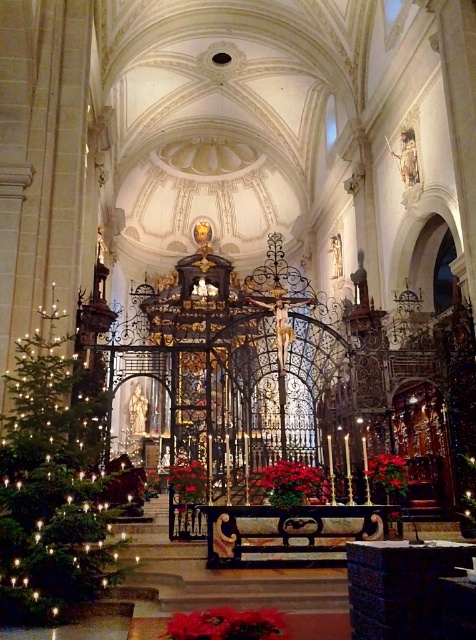
Is green matte christmas tree at left below red velvet poinsettia at lower center?

No.

Can you confirm if green matte christmas tree at left is shorter than red velvet poinsettia at lower center?

No.

This screenshot has height=640, width=476. Find the location of `green matte christmas tree at left`. green matte christmas tree at left is located at coordinates (51, 484).